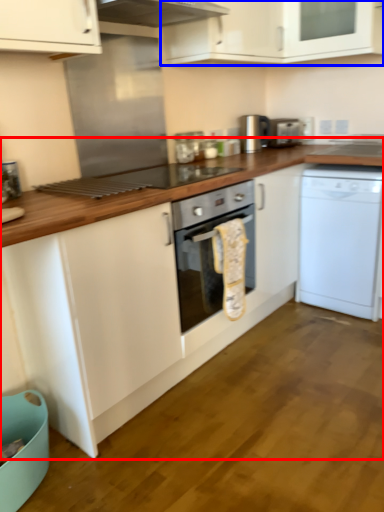
Question: Among these objects, which one is farthest to the camera, countertop (highlighted by a red box) or cabinetry (highlighted by a blue box)?

Choices:
 (A) countertop
 (B) cabinetry

Answer: (B)